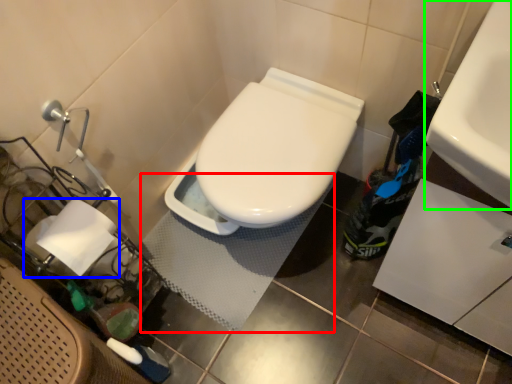
Question: Which object is positioned closest to bath mat (highlighted by a red box)? Select from toilet paper (highlighted by a blue box) and sink (highlighted by a green box).

Choices:
 (A) toilet paper
 (B) sink

Answer: (A)